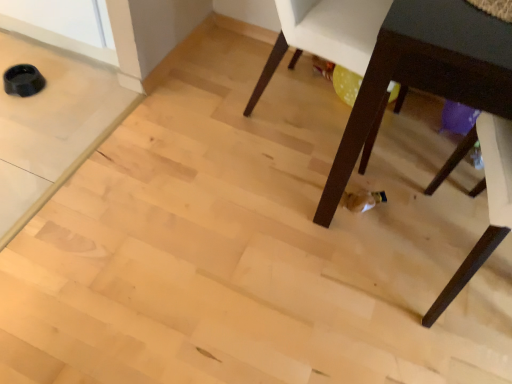
Where is `vacant space in front of white plastic chair at center, arranged as the second chair when ordered from the bottom`? vacant space in front of white plastic chair at center, arranged as the second chair when ordered from the bottom is located at coordinates click(266, 176).